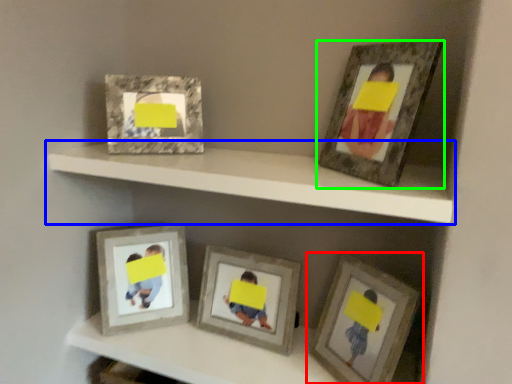
Question: Which object is positioned closest to picture frame (highlighted by a red box)? Select from shelf (highlighted by a blue box) and picture frame (highlighted by a green box).

Choices:
 (A) shelf
 (B) picture frame

Answer: (A)